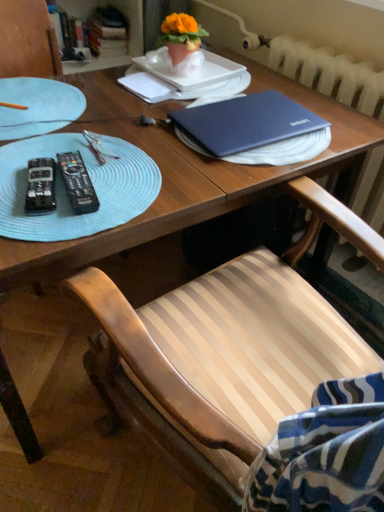
Where is `vacant area that lies in front of black plastic remote control at left, the first remote control viewed from the right`? Image resolution: width=384 pixels, height=512 pixels. vacant area that lies in front of black plastic remote control at left, the first remote control viewed from the right is located at coordinates (55, 228).